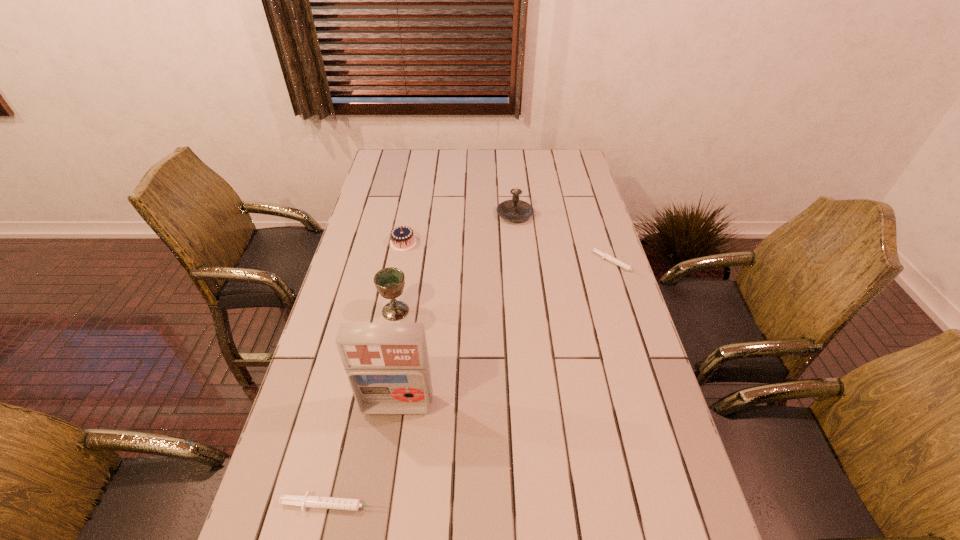
To make them evenly spaced by inserting another syringe among them, please locate a vacant spot for this new syringe. Please provide its 2D coordinates. Your answer should be formatted as a tuple, i.e. [(x, y)], where the tuple contains the x and y coordinates of a point satisfying the conditions above.

[(508, 357)]